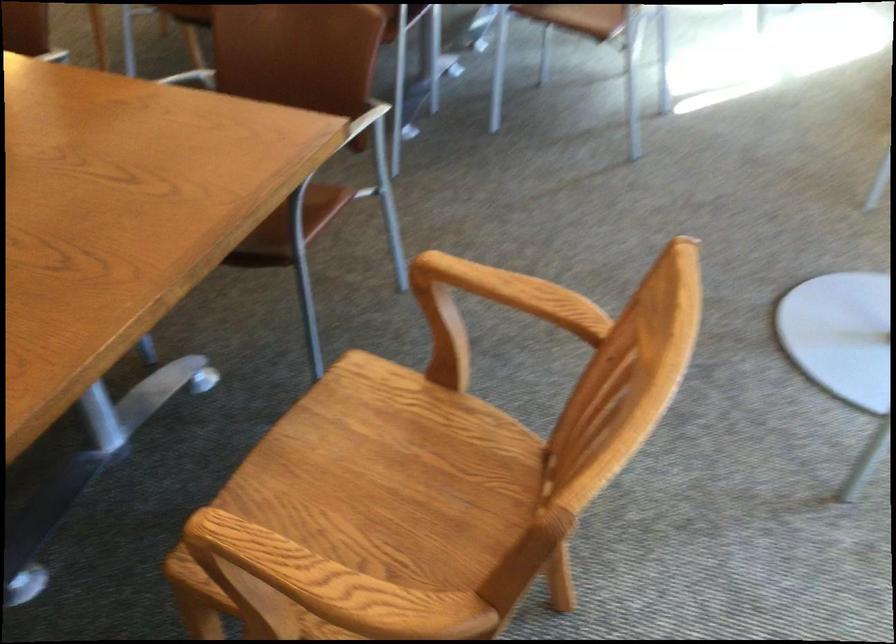
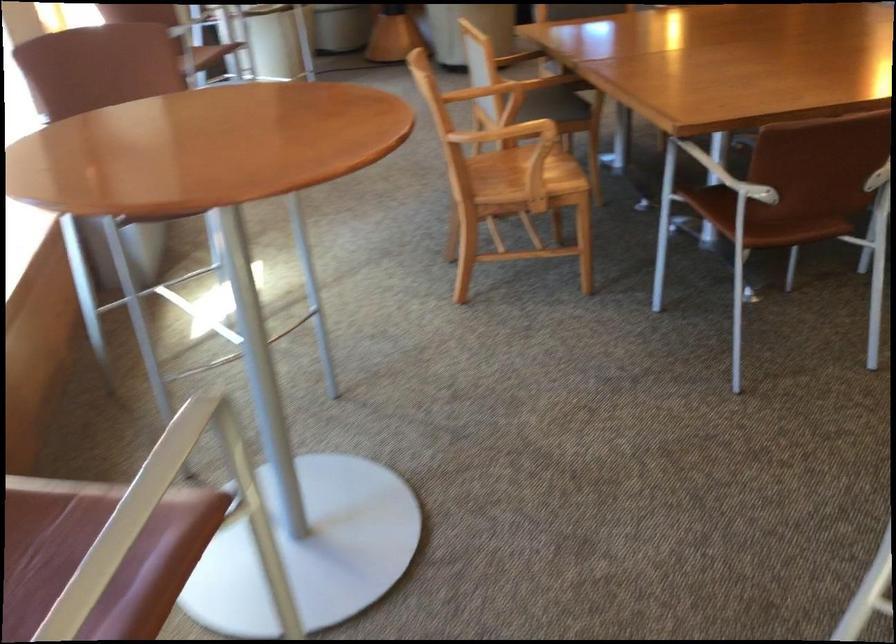
Question: I am providing you with two images of the same scene from different viewpoints. After the viewpoint changes to image2, which objects are now occluded?

Choices:
 (A) black power socket
 (B) brown chair sitting surface
 (C) wooden chair sitting surface
 (D) white chair armrest

Answer: (C)